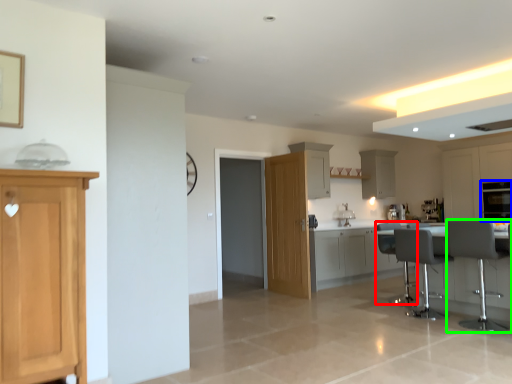
Question: Which is nearer to the swivel chair (highlighted by a red box)? oven (highlighted by a blue box) or chair (highlighted by a green box).

Choices:
 (A) oven
 (B) chair

Answer: (B)